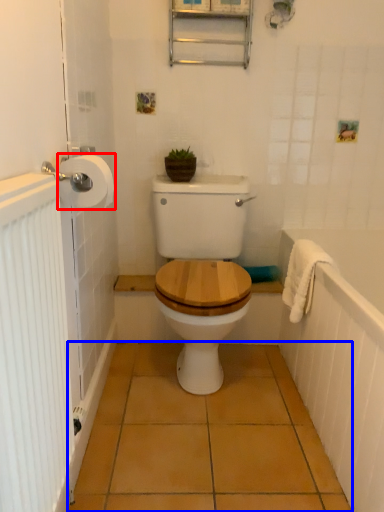
Question: Which object appears closest to the camera in this image, toilet paper (highlighted by a red box) or ceramic tile (highlighted by a blue box)?

Choices:
 (A) toilet paper
 (B) ceramic tile

Answer: (A)